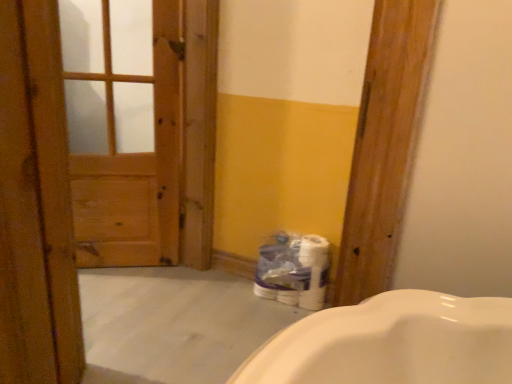
Where is `unoccupied region to the right of wooden door at left`? unoccupied region to the right of wooden door at left is located at coordinates (209, 312).